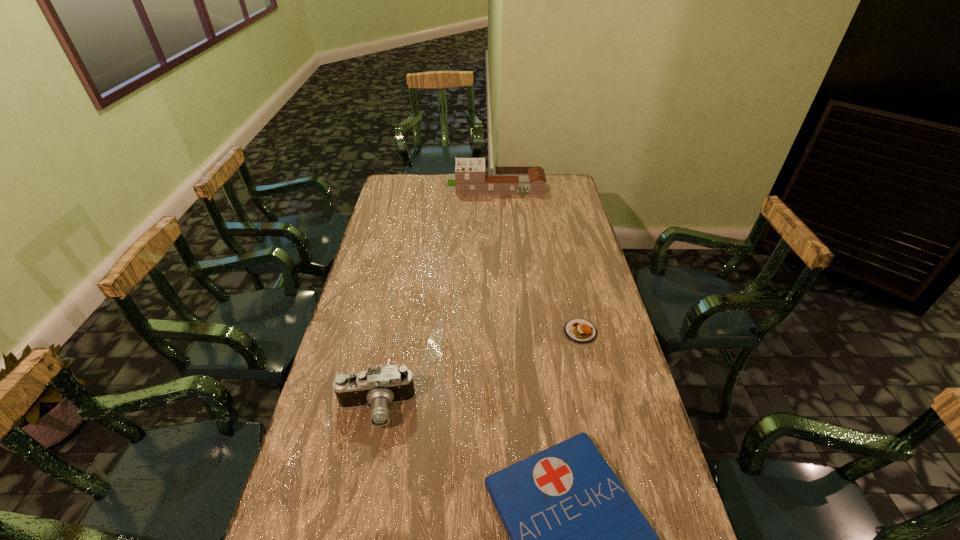
This screenshot has height=540, width=960. Identify the location of free area in between the leftmost object and the tallest object. (435, 296).

Locate an element on the screen. Image resolution: width=960 pixels, height=540 pixels. free space between the patty (food) and the second tallest object is located at coordinates (478, 370).

Where is `free space that is in between the dollhouse and the patty (food)`? free space that is in between the dollhouse and the patty (food) is located at coordinates (538, 258).

The width and height of the screenshot is (960, 540). I want to click on the third closest object to the camera, so click(x=471, y=177).

Identify which object is the closest to the tallest object. Please provide its 2D coordinates. Your answer should be formatted as a tuple, i.e. [(x, y)], where the tuple contains the x and y coordinates of a point satisfying the conditions above.

[(581, 331)]

You are a GUI agent. You are given a task and a screenshot of the screen. Output one action in this format:
    pyautogui.click(x=<x>, y=<y>)
    Task: Click on the blank space that satisfies the following two spatial constraints: 1. at the main entrance of the farthest object; 2. at the lens of the third shortest object
    Image resolution: width=960 pixels, height=540 pixels.
    Given the screenshot: What is the action you would take?
    pyautogui.click(x=507, y=409)